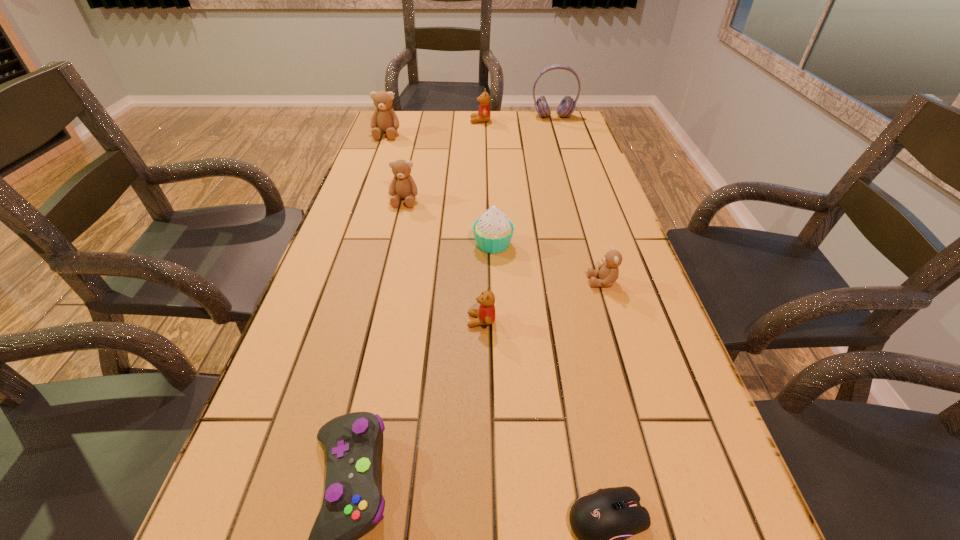
Where is `the nearest brown teddy bear`? The image size is (960, 540). the nearest brown teddy bear is located at coordinates (608, 272).

This screenshot has height=540, width=960. I want to click on the nearer red teddy bear, so click(485, 315).

Where is `the third nearest object`? Image resolution: width=960 pixels, height=540 pixels. the third nearest object is located at coordinates (485, 315).

Identify the location of vacant region located on the headband and ear cups of the headset. (570, 172).

The width and height of the screenshot is (960, 540). I want to click on vacant space located 0.290m on the front-facing side of the biggest brown teddy bear, so [x=369, y=182].

I want to click on vacant space situated on the front-facing side of the bigger red teddy bear, so click(426, 121).

Identify the location of vacant region located 0.050m on the front-facing side of the bigger red teddy bear. This screenshot has height=540, width=960. (458, 121).

Identify the location of vacant space located 0.100m on the front-facing side of the bigger red teddy bear. (444, 121).

Where is `vacant region located on the front-facing side of the second nearest brown teddy bear`? vacant region located on the front-facing side of the second nearest brown teddy bear is located at coordinates (378, 310).

Find the location of a particular element. vacant space located on the left of the cupcake is located at coordinates (379, 244).